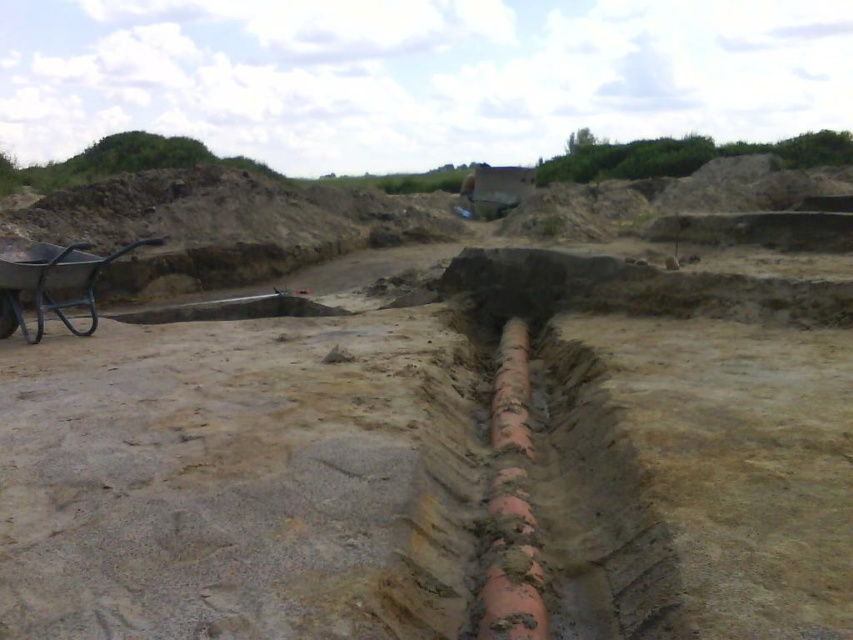
Based on the photo, does rusty clay pipe at center have a larger size compared to metallic wheelbarrow at left?

Yes, rusty clay pipe at center is bigger than metallic wheelbarrow at left.

Between point (500, 604) and point (44, 257), which one is positioned behind?

Point (44, 257)

Identify the location of rusty clay pipe at center. (511, 504).